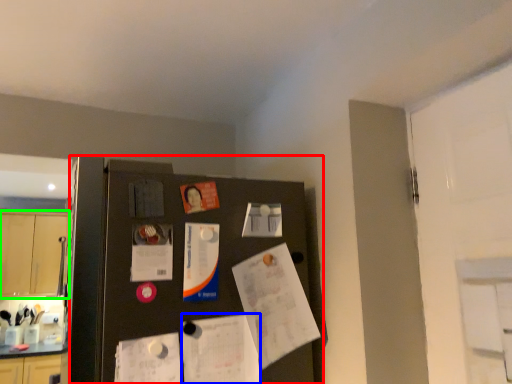
Question: Based on their relative distances, which object is farther from fridge (highlighted by a red box)? Choose from poster (highlighted by a blue box) and cabinetry (highlighted by a green box).

Choices:
 (A) poster
 (B) cabinetry

Answer: (B)